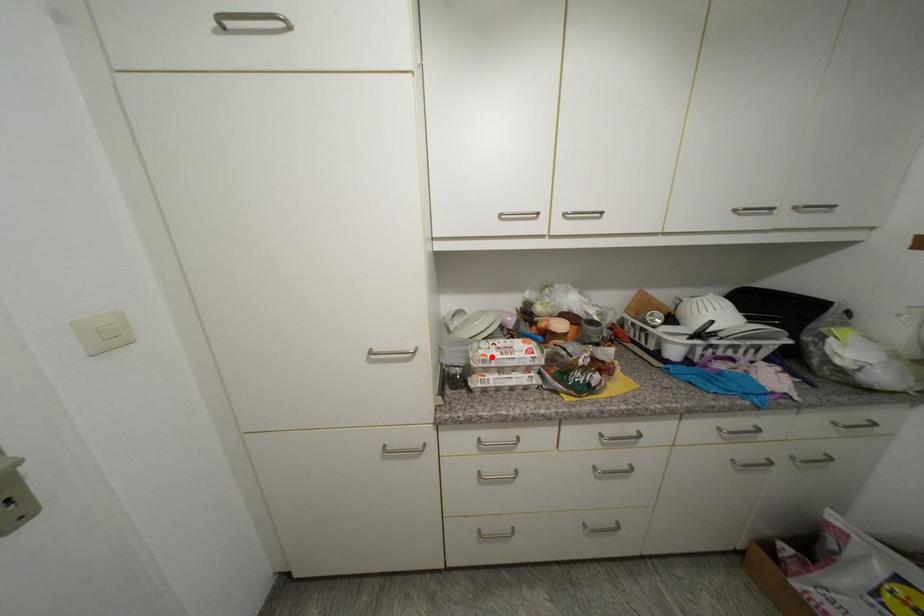
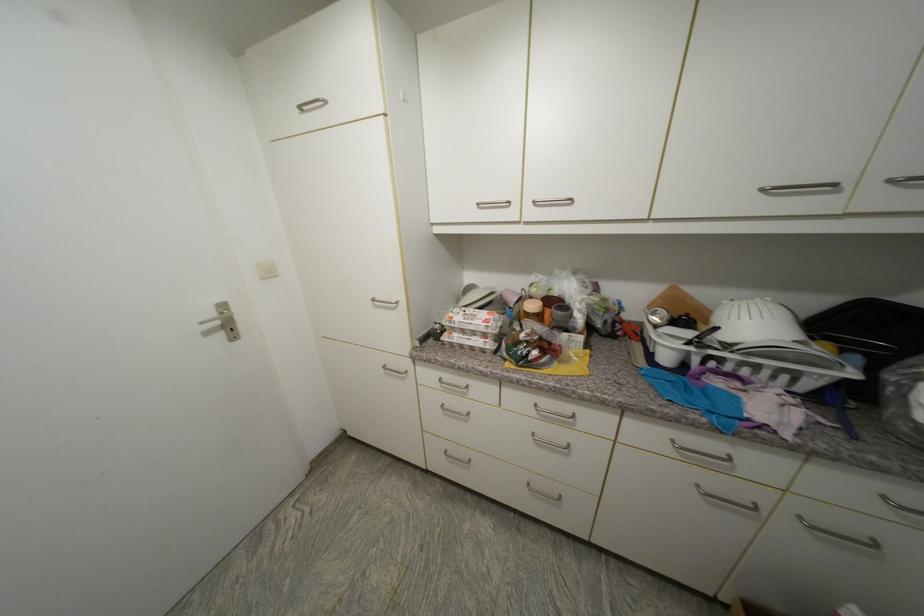
Where in the second image is the point corresponding to the highlighted location from the first image?

(457, 318)